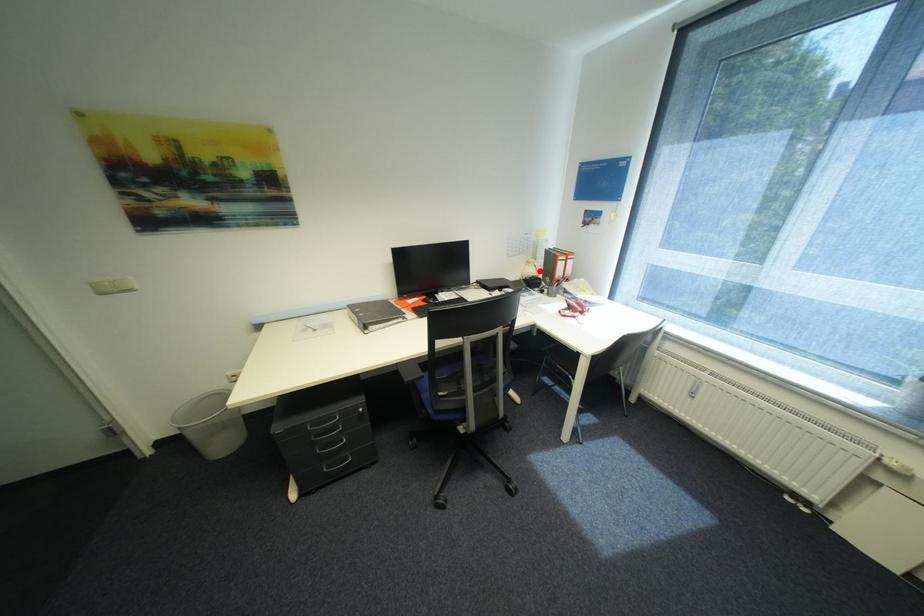
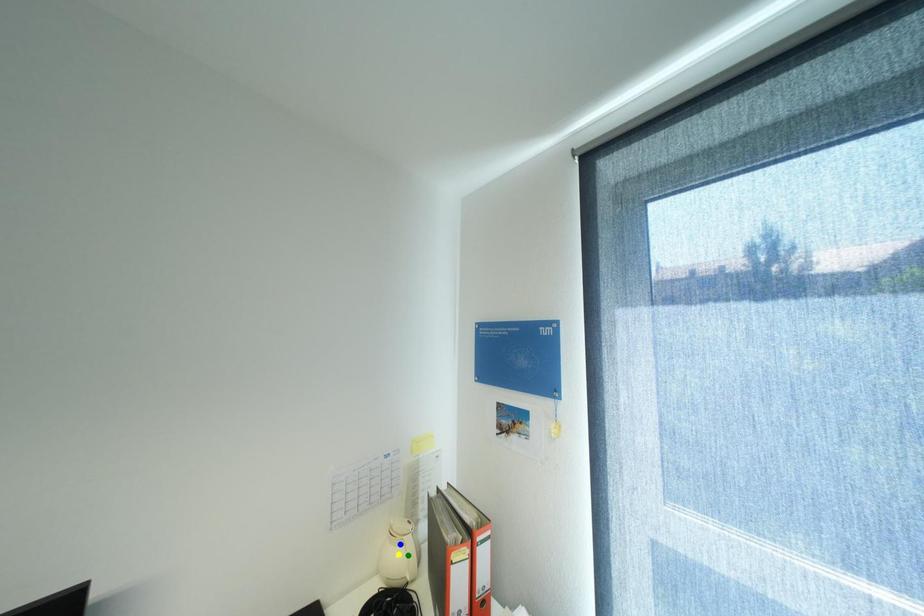
Question: I am providing you with two images of the same scene from different viewpoints. A red point is marked on the first image. You are given multiple points on the second image. Can you choose the point in image 2 that corresponds to the point in image 1?

Choices:
 (A) green point
 (B) blue point
 (C) yellow point

Answer: (A)